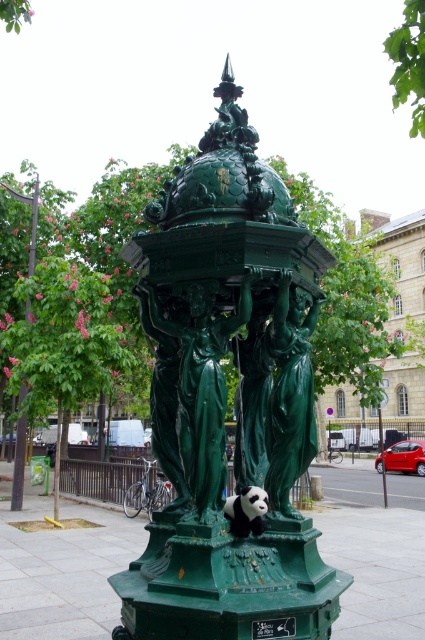
This screenshot has height=640, width=425. Describe the element at coordinates (223, 378) in the screenshot. I see `green polished water fountain at center` at that location.

Identify the location of green polished water fountain at center. This screenshot has width=425, height=640. (223, 378).

You are a GUI agent. You are given a task and a screenshot of the screen. Output one action in this format:
    pyautogui.click(x=<x>, y=<y>)
    Task: Click on the green polished water fountain at center
    Image resolution: width=425 pixels, height=640 pixels.
    Given the screenshot: What is the action you would take?
    pyautogui.click(x=223, y=378)